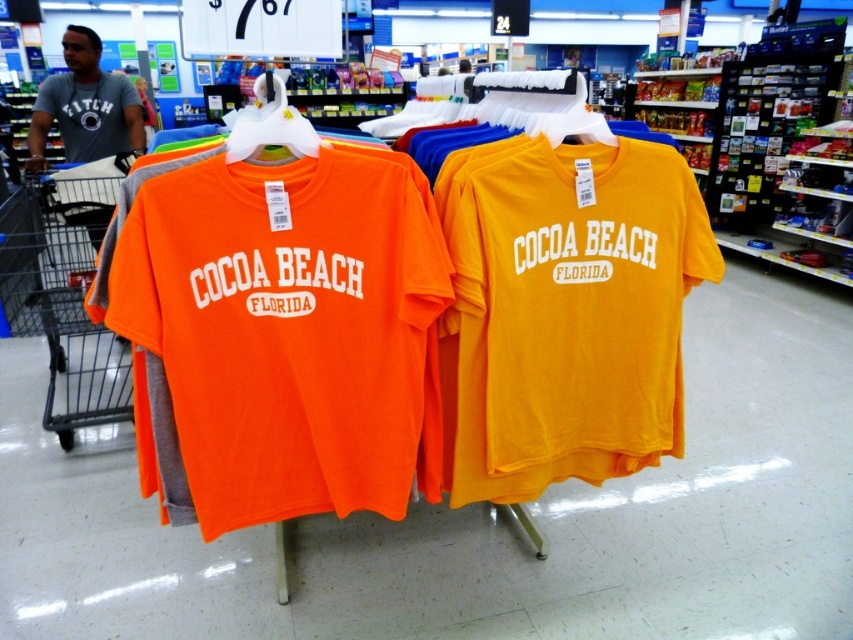
Does matte yellow t-shirt at center lie behind metallic gray shopping cart at lower left?

No, matte yellow t-shirt at center is closer to the viewer.

Which is in front, point (454, 470) or point (84, 230)?

Point (454, 470) is more forward.

Find the location of a particular element. matte yellow t-shirt at center is located at coordinates (567, 316).

Is point (80, 401) positioned before point (67, 134)?

Yes, point (80, 401) is in front of point (67, 134).

Who is lower down, metallic gray shopping cart at lower left or gray cotton shirt at upper left?

metallic gray shopping cart at lower left

Where is `metallic gray shopping cart at lower left`? metallic gray shopping cart at lower left is located at coordinates (76, 301).

Does orange matte t-shirt at center have a larger size compared to metallic gray shopping cart at lower left?

Actually, orange matte t-shirt at center might be smaller than metallic gray shopping cart at lower left.

The height and width of the screenshot is (640, 853). I want to click on orange matte t-shirt at center, so tap(283, 337).